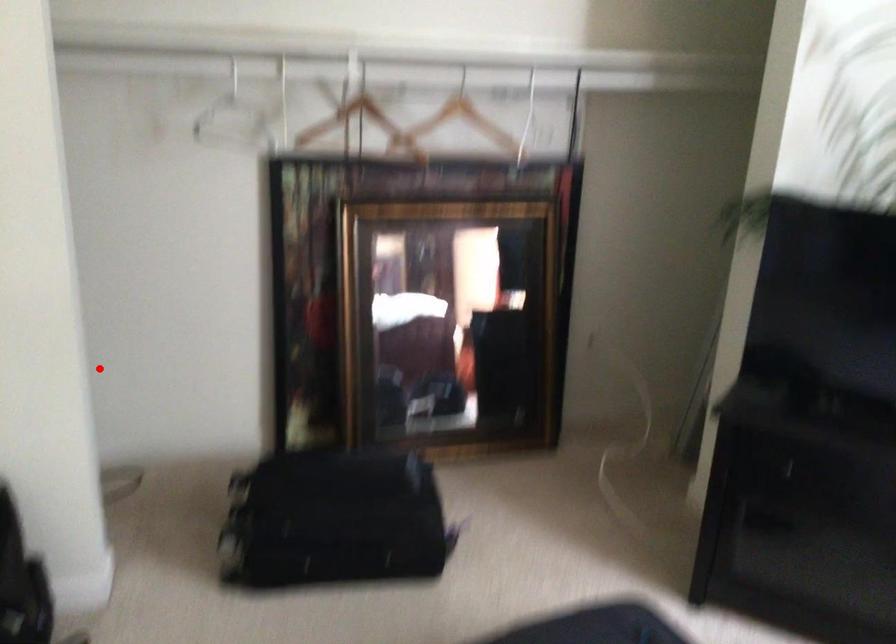
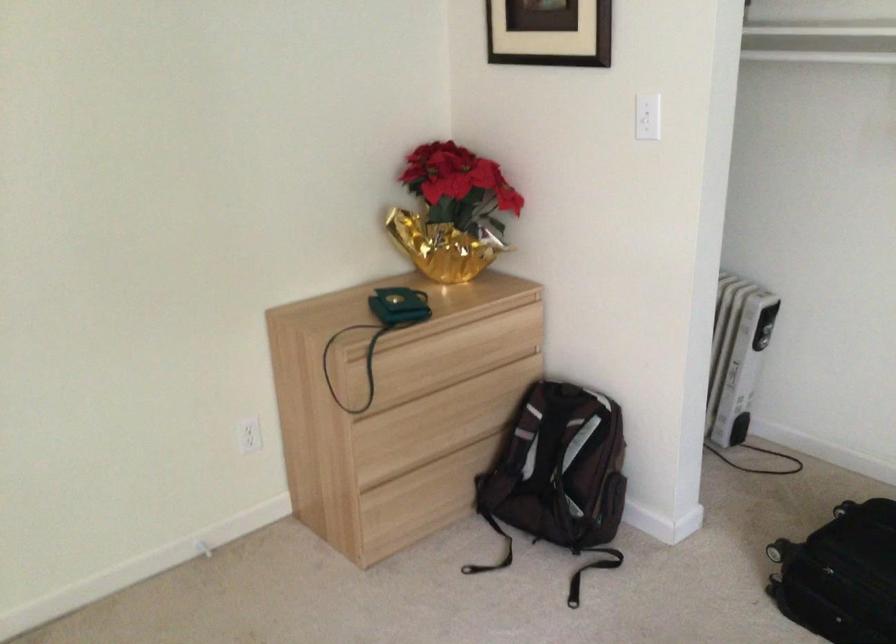
Find the pixel in the second image that matches the highlighted location in the first image.

(761, 339)